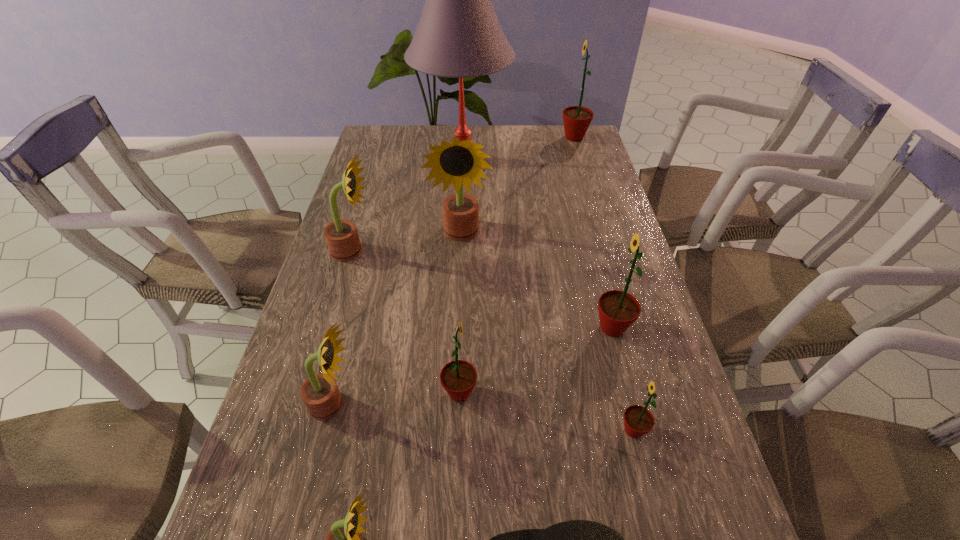
The height and width of the screenshot is (540, 960). Identify the location of vacant region located 0.390m on the face of the third nearest green sunflower. (433, 328).

Where is `free space located on the face of the third farthest yellow sunflower`? free space located on the face of the third farthest yellow sunflower is located at coordinates (480, 404).

Where is `vacant region located on the face of the second smallest green sunflower`? This screenshot has width=960, height=540. vacant region located on the face of the second smallest green sunflower is located at coordinates (588, 393).

This screenshot has height=540, width=960. I want to click on vacant space located 0.270m on the face of the smallest green sunflower, so click(x=486, y=430).

Find the location of a particular element. vacant space located on the face of the smallest green sunflower is located at coordinates (491, 430).

Where is `free point located 0.240m on the face of the smallest green sunflower`? The image size is (960, 540). free point located 0.240m on the face of the smallest green sunflower is located at coordinates (501, 430).

Image resolution: width=960 pixels, height=540 pixels. Identify the location of table lamp at the far edge. (458, 35).

The image size is (960, 540). I want to click on sunflower that is at the far edge, so coord(577,119).

This screenshot has width=960, height=540. In order to click on object present at the far right corner in this screenshot , I will do `click(577, 119)`.

Where is `vacant space at the far edge of the desktop`? vacant space at the far edge of the desktop is located at coordinates (468, 127).